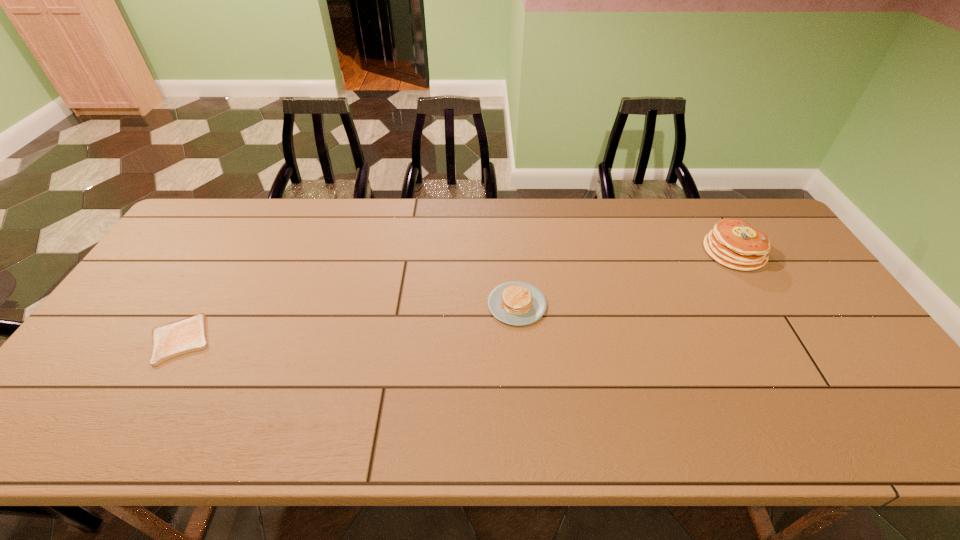
This screenshot has width=960, height=540. In order to click on the tallest object in this screenshot , I will do `click(733, 243)`.

The width and height of the screenshot is (960, 540). Identify the location of the right pancake. (733, 243).

The width and height of the screenshot is (960, 540). What are the coordinates of `the second shortest object` in the screenshot? It's located at (516, 303).

This screenshot has height=540, width=960. What are the coordinates of `the shorter pancake` in the screenshot? It's located at (516, 303).

At what (x,y) coordinates should I click in order to perform the action: click on toast. Please return your answer as a coordinate pair (x, y). Looking at the image, I should click on (187, 335).

This screenshot has height=540, width=960. In order to click on the leftmost object in this screenshot , I will do `click(187, 335)`.

This screenshot has width=960, height=540. What are the coordinates of `vacant point located on the right of the taller pancake` in the screenshot? It's located at (792, 252).

Identify the location of vacant space situated on the right of the left pancake. This screenshot has height=540, width=960. (579, 305).

This screenshot has width=960, height=540. I want to click on vacant point located on the right of the toast, so point(234,340).

Image resolution: width=960 pixels, height=540 pixels. I want to click on object that is positioned at the far edge, so click(x=733, y=243).